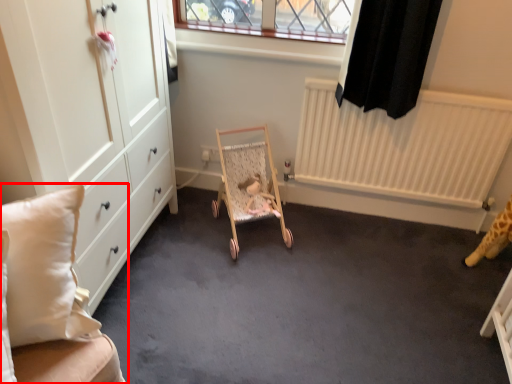
Question: In this image, where is furniture (annotated by the red box) located relative to baby carriage?

Choices:
 (A) left
 (B) right

Answer: (A)